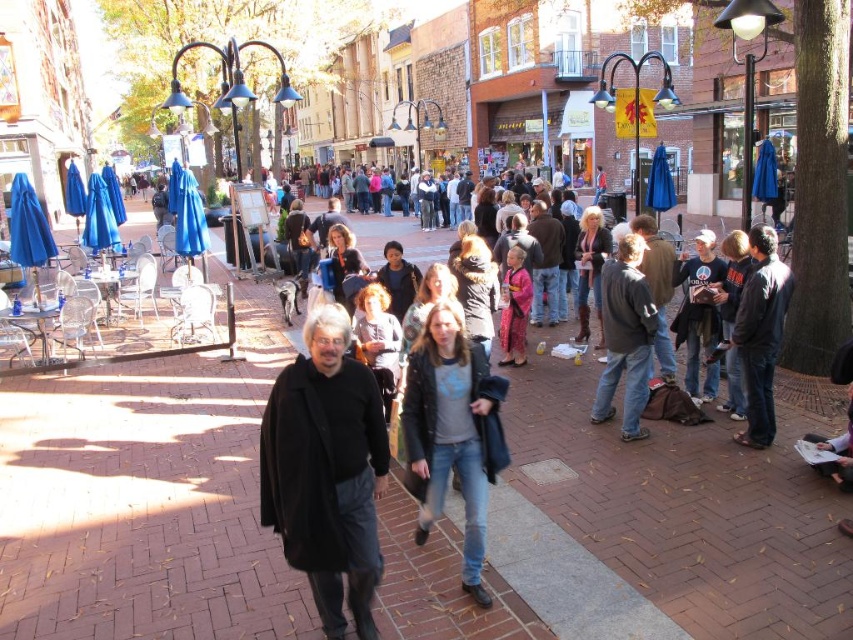
Does point (695, 266) lie in front of point (515, 332)?

Yes.

Find the location of a particular element. This screenshot has height=640, width=853. dark blue jeans at center is located at coordinates (699, 314).

Is black matte coat at center above dark gray jacket at center?

No.

Is point (339, 560) behind point (605, 284)?

No, (339, 560) is in front of (605, 284).

This screenshot has height=640, width=853. I want to click on black matte coat at center, so click(x=326, y=472).

Which is below, black matte coat at center or denim jacket at center?

Positioned lower is black matte coat at center.

Who is shorter, black matte coat at center or denim jacket at center?

denim jacket at center is shorter.

Is point (363, 419) positioned after point (422, 472)?

That is False.

Where is `black matte coat at center`? The width and height of the screenshot is (853, 640). black matte coat at center is located at coordinates (326, 472).